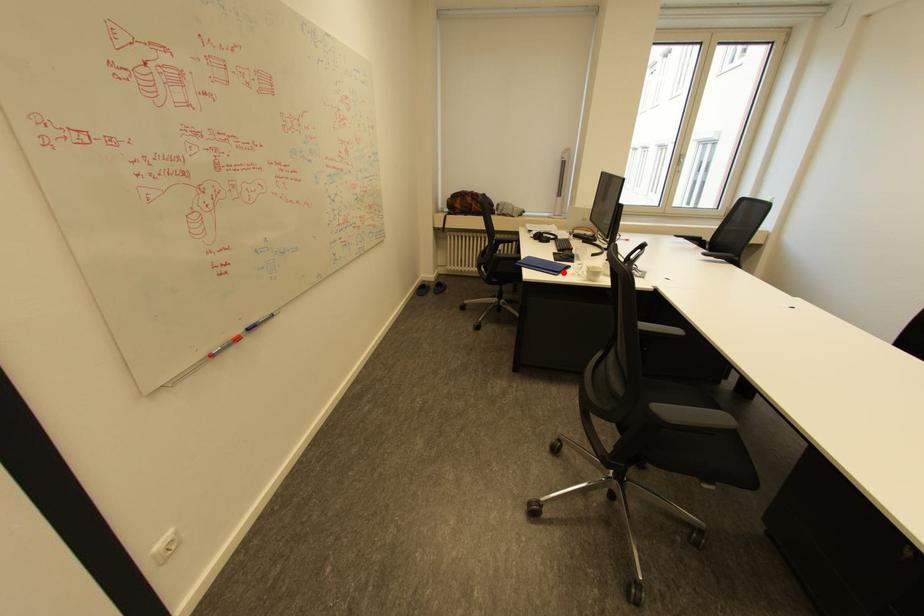
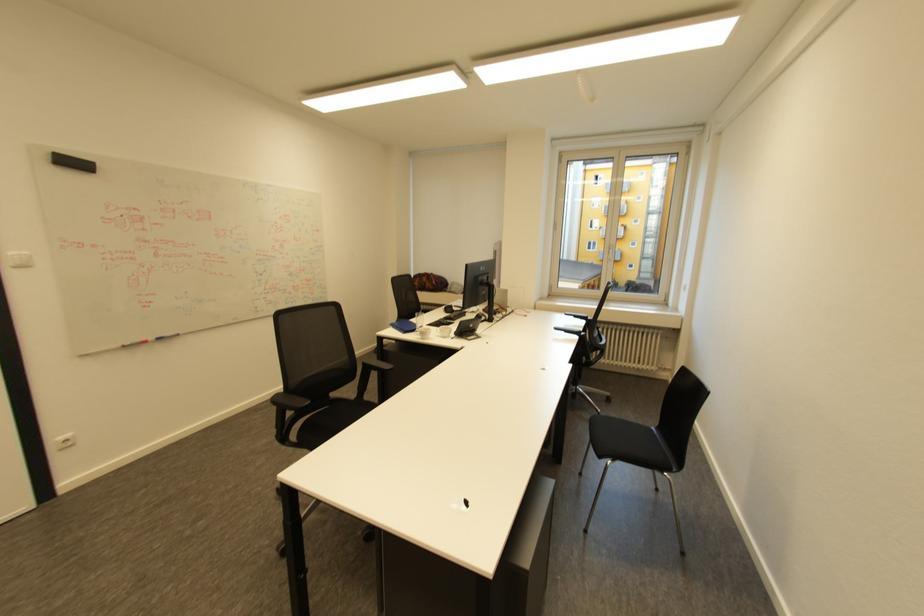
Question: I am providing you with two images of the same scene from different viewpoints. Given a red point in image1, look at the same physical point in image2. Is it:

Choices:
 (A) Closer to the viewpoint
 (B) Farther from the viewpoint

Answer: (B)